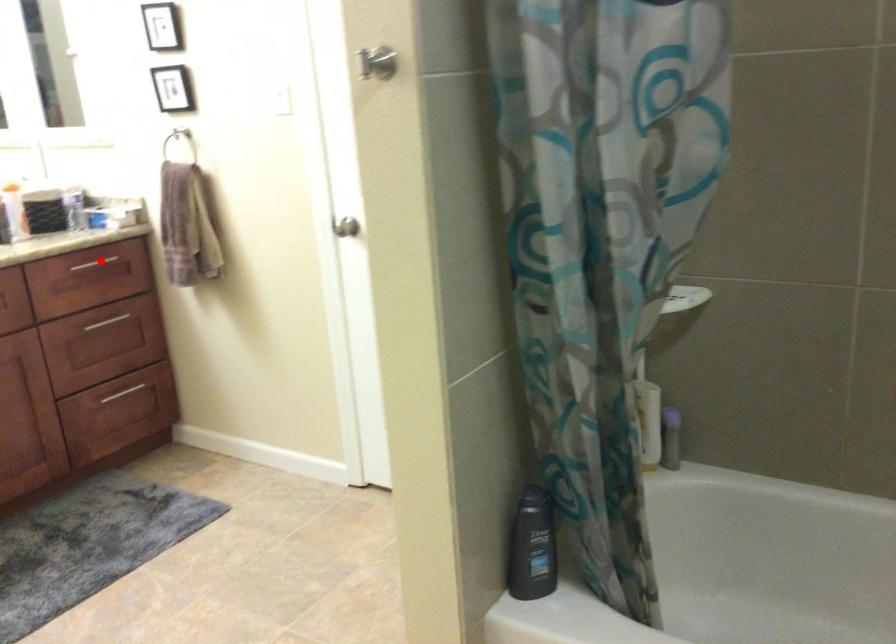
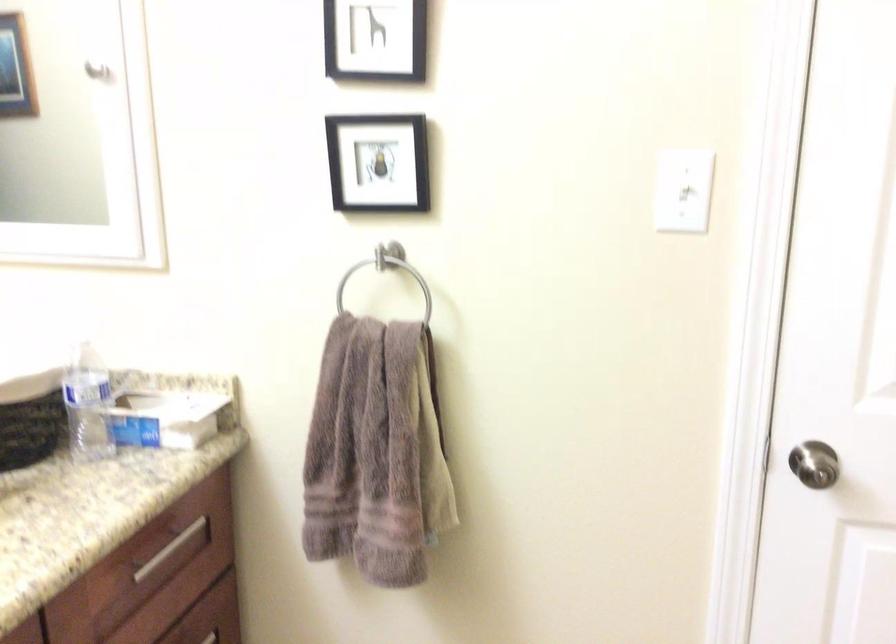
Question: A red point is marked in image1. In image2, is the corresponding 3D point closer to the camera or farther? Reply with the corresponding letter.

Choices:
 (A) The corresponding 3D point is closer.
 (B) The corresponding 3D point is farther.

Answer: (A)